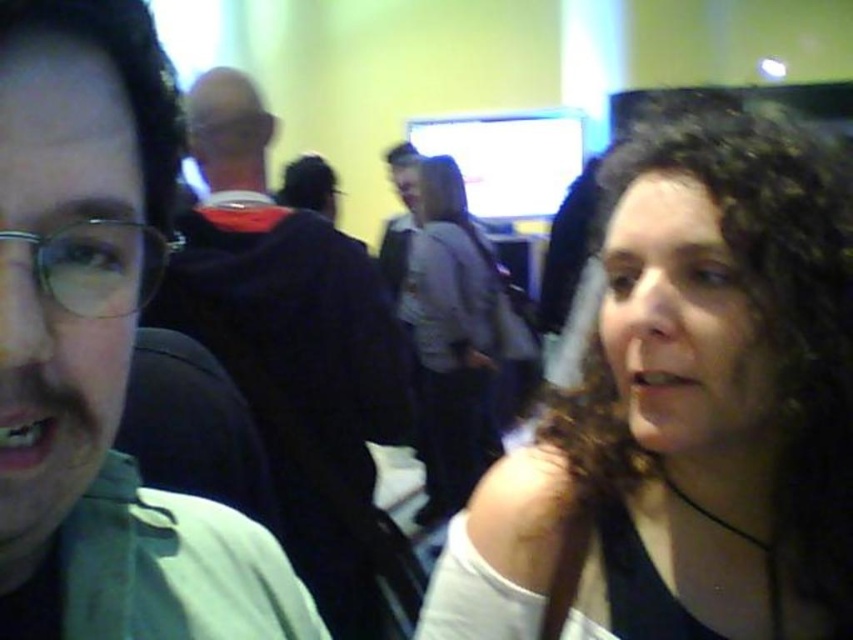
Based on the photo, you are at a social event and want to take a photo of the dark curly hair at upper right and the gray fabric shirt at center. Which one is positioned to the right side of the other?

The dark curly hair at upper right is positioned to the right of the gray fabric shirt at center.

You are holding a camera and want to take a photo of the point at coordinates (125, 122). The camera is currently 13.11 inches away from that point. If you need to adjust the focus ring to ensure the subject is in sharp focus, should you move the focus ring to a shorter distance or a longer distance than the current setting?

The point at coordinates (125, 122) is 13.11 inches away from the camera. To focus on this point, the focus ring should be set to match the distance of 13.11 inches. Since the camera is already at that distance, no adjustment is needed. However, if the focus ring is currently set to a different distance, you would need to adjust it to 13.11 inches. The question mentions adjusting to a shorter or longer distance, but without knowing the current setting, it can be answered as follows based on the given info

You are a photographer adjusting your camera settings. You notice the green matte shirt at left and the matte black glasses at center in your viewfinder. Which object should you focus on if you want to prioritize the one closer to the camera?

The matte black glasses at center are closer to the camera because they are shorter in height compared to the green matte shirt at left, which is taller. Therefore, focusing on the matte black glasses at center would prioritize the closer object.